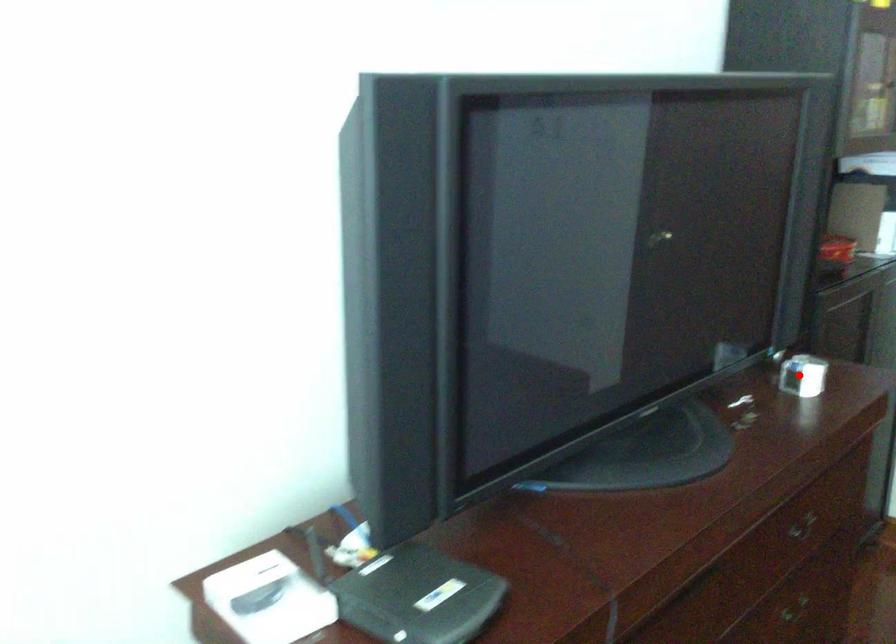
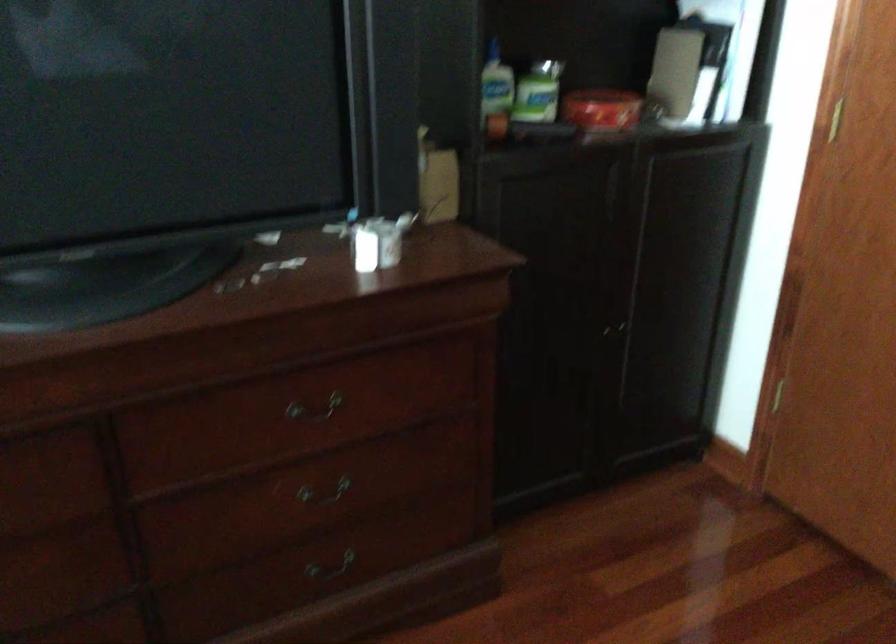
Find the pixel in the second image that matches the highlighted location in the first image.

(378, 242)